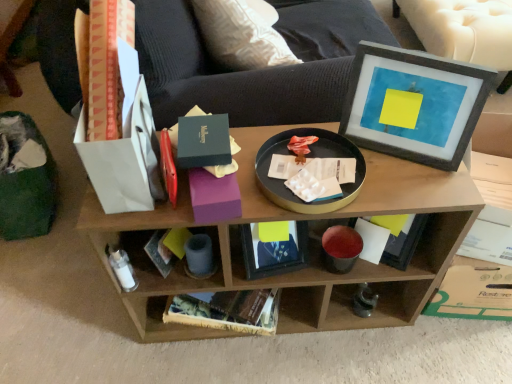
Question: From the image's perspective, does white paper book at lower center appear higher than wooden shelf at center?

Choices:
 (A) yes
 (B) no

Answer: (B)

Question: Is white paper book at lower center positioned before wooden shelf at center?

Choices:
 (A) yes
 (B) no

Answer: (B)

Question: Is white paper book at lower center completely or partially outside of wooden shelf at center?

Choices:
 (A) no
 (B) yes

Answer: (A)

Question: Is white paper book at lower center to the right of wooden shelf at center from the viewer's perspective?

Choices:
 (A) yes
 (B) no

Answer: (A)

Question: Does white paper book at lower center have a smaller size compared to wooden shelf at center?

Choices:
 (A) yes
 (B) no

Answer: (A)

Question: Considering their positions, is black matte tray at center located in front of or behind wooden shelf at center?

Choices:
 (A) behind
 (B) front

Answer: (B)

Question: Is black matte tray at center taller or shorter than wooden shelf at center?

Choices:
 (A) tall
 (B) short

Answer: (B)

Question: From the image's perspective, is black matte tray at center positioned above or below wooden shelf at center?

Choices:
 (A) below
 (B) above

Answer: (B)

Question: Is black matte tray at center wider or thinner than wooden shelf at center?

Choices:
 (A) wide
 (B) thin

Answer: (B)

Question: Considering the relative positions of wooden shelf at center and matte gray picture frame at upper right in the image provided, is wooden shelf at center to the left or to the right of matte gray picture frame at upper right?

Choices:
 (A) left
 (B) right

Answer: (A)

Question: Is wooden shelf at center taller or shorter than matte gray picture frame at upper right?

Choices:
 (A) tall
 (B) short

Answer: (A)

Question: In terms of size, does wooden shelf at center appear bigger or smaller than matte gray picture frame at upper right?

Choices:
 (A) big
 (B) small

Answer: (A)

Question: From the image's perspective, relative to matte gray picture frame at upper right, is wooden shelf at center above or below?

Choices:
 (A) above
 (B) below

Answer: (B)

Question: Does point (412, 223) appear closer or farther from the camera than point (459, 144)?

Choices:
 (A) farther
 (B) closer

Answer: (A)

Question: In the image, is white paper book at lower center positioned in front of or behind matte gray picture frame at upper right?

Choices:
 (A) behind
 (B) front

Answer: (A)